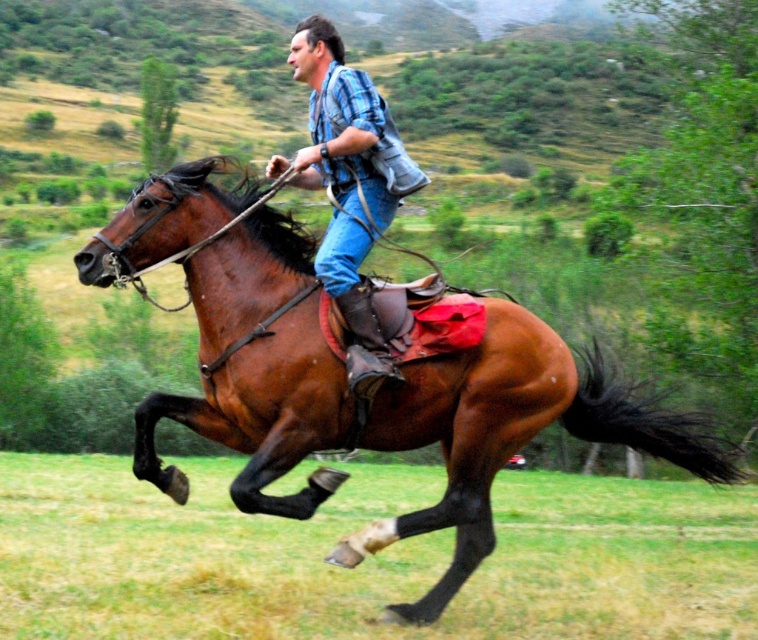
Question: Which object is the closest to the green grass at lower center?

Choices:
 (A) brown leather horse at center
 (B) plaid shirt at center

Answer: (A)

Question: Which is farther from the green grass at lower center?

Choices:
 (A) plaid shirt at center
 (B) brown leather horse at center

Answer: (A)

Question: Can you confirm if green grass at lower center is positioned below brown leather horse at center?

Choices:
 (A) no
 (B) yes

Answer: (B)

Question: Does green grass at lower center appear under plaid shirt at center?

Choices:
 (A) yes
 (B) no

Answer: (A)

Question: Does brown leather horse at center appear on the left side of plaid shirt at center?

Choices:
 (A) no
 (B) yes

Answer: (A)

Question: Which of the following is the farthest from the observer?

Choices:
 (A) plaid shirt at center
 (B) brown leather horse at center
 (C) green grass at lower center

Answer: (A)